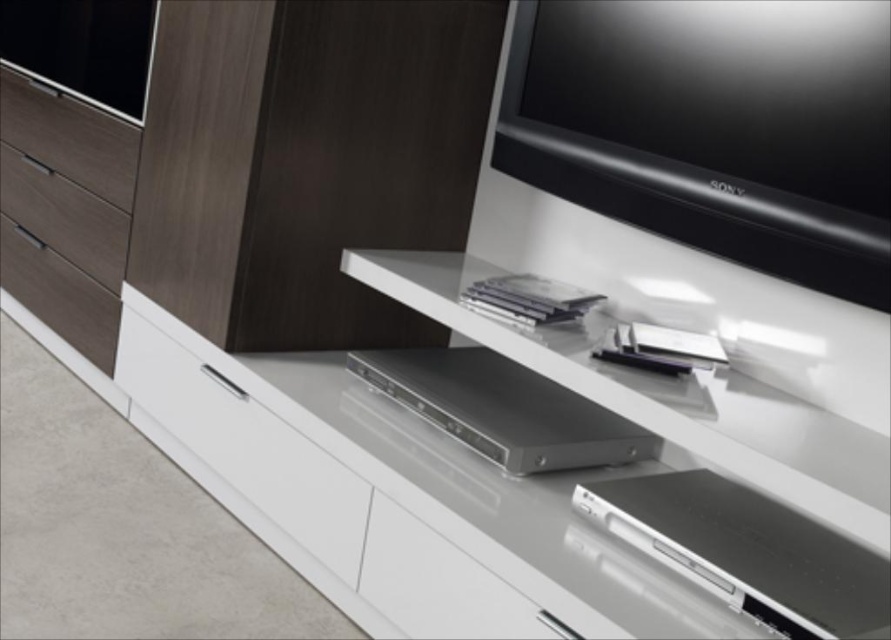
You are a delivery person who just arrived at the house and need to place a new DVD on the entertainment unit. The owner specified that the DVD should be placed exactly where the point at coordinate point (69, 138) is located. However, you can only see the entertainment unit from the front. Can you determine if the DVD will be placed on a glossy white shelf or a matte wood drawer?

The point at coordinate point (69, 138) is on matte wood drawer at upper left, so the DVD will be placed on a matte wood drawer instead of a glossy white shelf.

You are organizing the entertainment unit and need to place a large collection of DVDs. Which drawer, the matte wood drawer at upper left or the matte wood drawer at left, can accommodate more DVDs due to its size?

The matte wood drawer at upper left has a larger size compared to the matte wood drawer at left, so it can accommodate more DVDs.

You need to place a rectangular box that is 30 cm wide into the entertainment unit. The white glossy drawer at lower left and the matte wood drawer at left are both available. Which drawer can accommodate the box based on their widths?

The white glossy drawer at lower left has a greater width than the matte wood drawer at left, so the box can fit in the white glossy drawer at lower left if its width is 30 cm or less.